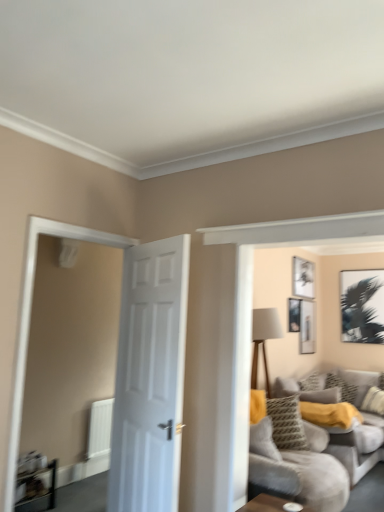
How much space does patterned fabric pillow at center-right, arranged as the third pillow when viewed from the right, occupy vertically?

patterned fabric pillow at center-right, arranged as the third pillow when viewed from the right, is 11.80 inches tall.

The width and height of the screenshot is (384, 512). What do you see at coordinates (37, 490) in the screenshot?
I see `wooden table at lower left` at bounding box center [37, 490].

What do you see at coordinates (342, 387) in the screenshot? I see `yellow textured pillow at center, the second pillow from the left` at bounding box center [342, 387].

The width and height of the screenshot is (384, 512). What do you see at coordinates (373, 401) in the screenshot?
I see `patterned fabric pillow at right, which is the third pillow in left-to-right order` at bounding box center [373, 401].

Find the location of a particular element. This screenshot has height=512, width=384. clear glass door at left is located at coordinates (29, 322).

Locate an element on the screen. The width and height of the screenshot is (384, 512). patterned fabric pillow at center-right, which appears as the first pillow when viewed from the left is located at coordinates (313, 382).

Is clear glass door at left to the left or to the right of white matte picture frame at upper center, which is the 2th picture frame from left to right, in the image?

Based on their positions, clear glass door at left is located to the left of white matte picture frame at upper center, which is the 2th picture frame from left to right.

Which of these two, clear glass door at left or white matte picture frame at upper center, which is the 2th picture frame from left to right, is smaller?

With smaller size is white matte picture frame at upper center, which is the 2th picture frame from left to right.

Is clear glass door at left facing towards white matte picture frame at upper center, which is the 2th picture frame from left to right?

No, clear glass door at left is not turned towards white matte picture frame at upper center, which is the 2th picture frame from left to right.

From the image's perspective, would you say clear glass door at left is positioned over white matte picture frame at upper center, the 3th picture frame positioned from the right?

Actually, clear glass door at left appears below white matte picture frame at upper center, the 3th picture frame positioned from the right, in the image.

Consider the image. Are yellow textured pillow at center, which ranks as the second pillow in right-to-left order, and matte black picture frame at upper center, which is the fourth picture frame from right to left, making contact?

They are not placed beside each other.

Is yellow textured pillow at center, the second pillow from the left, oriented away from matte black picture frame at upper center, marked as the first picture frame in a left-to-right arrangement?

That's not correct — yellow textured pillow at center, the second pillow from the left, is not looking away from matte black picture frame at upper center, marked as the first picture frame in a left-to-right arrangement.

From a real-world perspective, is yellow textured pillow at center, which ranks as the second pillow in right-to-left order, over matte black picture frame at upper center, marked as the first picture frame in a left-to-right arrangement?

No, from a real-world perspective, yellow textured pillow at center, which ranks as the second pillow in right-to-left order, is not above matte black picture frame at upper center, marked as the first picture frame in a left-to-right arrangement.

Looking at the image, does yellow textured pillow at center, which ranks as the second pillow in right-to-left order, seem bigger or smaller compared to matte black picture frame at upper center, which is the fourth picture frame from right to left?

Clearly, yellow textured pillow at center, which ranks as the second pillow in right-to-left order, is larger in size than matte black picture frame at upper center, which is the fourth picture frame from right to left.

Is point (300, 286) closer or farther from the camera than point (317, 390)?

Point (300, 286) appears to be farther away from the viewer than point (317, 390).

From the image's perspective, which picture frame is the 4th one above the patterned fabric pillow at center-right, which appears as the first pillow when viewed from the left? Please provide its 2D coordinates.

[(303, 278)]

Are white matte picture frame at upper center, the 3th picture frame positioned from the right, and patterned fabric pillow at center-right, which appears as the first pillow when viewed from the left, located far from each other?

Yes.

Between point (296, 300) and point (367, 404), which one is positioned behind?

The point (296, 300) is farther from the camera.

Where is `the 3rd pillow below the matte black picture frame at upper center, which is the fourth picture frame from right to left (from the image's perspective)`? The width and height of the screenshot is (384, 512). the 3rd pillow below the matte black picture frame at upper center, which is the fourth picture frame from right to left (from the image's perspective) is located at coordinates (373, 401).

From the image's perspective, would you say matte black picture frame at upper center, marked as the first picture frame in a left-to-right arrangement, is shown under patterned fabric pillow at right, which is the third pillow in left-to-right order?

Actually, matte black picture frame at upper center, marked as the first picture frame in a left-to-right arrangement, appears above patterned fabric pillow at right, which is the third pillow in left-to-right order, in the image.

Is matte black picture frame at upper center, marked as the first picture frame in a left-to-right arrangement, taller or shorter than patterned fabric pillow at right, which is the third pillow in left-to-right order?

In the image, matte black picture frame at upper center, marked as the first picture frame in a left-to-right arrangement, appears to be shorter than patterned fabric pillow at right, which is the third pillow in left-to-right order.

Does clear glass door at left have a larger size compared to matte black picture frame at upper right, marked as the second picture frame in a right-to-left arrangement?

Indeed, clear glass door at left has a larger size compared to matte black picture frame at upper right, marked as the second picture frame in a right-to-left arrangement.

Considering the relative sizes of clear glass door at left and matte black picture frame at upper right, marked as the second picture frame in a right-to-left arrangement, in the image provided, is clear glass door at left wider than matte black picture frame at upper right, marked as the second picture frame in a right-to-left arrangement,?

Correct, the width of clear glass door at left exceeds that of matte black picture frame at upper right, marked as the second picture frame in a right-to-left arrangement.

Is point (84, 228) in front of point (315, 344)?

Yes, point (84, 228) is in front of point (315, 344).

Between clear glass door at left and wooden table at lower left, which one is positioned behind?

wooden table at lower left is further from the camera.

Does clear glass door at left have a greater height compared to wooden table at lower left?

Indeed, clear glass door at left has a greater height compared to wooden table at lower left.

The image size is (384, 512). I want to click on glass door lying in front of the wooden table at lower left, so click(29, 322).

In the scene shown: Can we say clear glass door at left lies outside wooden table at lower left?

Indeed, clear glass door at left is completely outside wooden table at lower left.

Is patterned fabric pillow at center-right, arranged as the third pillow when viewed from the right, facing away from yellow textured pillow at center, which ranks as the second pillow in right-to-left order?

That's not correct — patterned fabric pillow at center-right, arranged as the third pillow when viewed from the right, is not looking away from yellow textured pillow at center, which ranks as the second pillow in right-to-left order.

Who is shorter, patterned fabric pillow at center-right, arranged as the third pillow when viewed from the right, or yellow textured pillow at center, the second pillow from the left?

patterned fabric pillow at center-right, arranged as the third pillow when viewed from the right, is shorter.

Which is nearer, (325, 374) or (329, 385)?

Point (329, 385)

Is patterned fabric pillow at center-right, which appears as the first pillow when viewed from the left, not near yellow textured pillow at center, the second pillow from the left?

They are positioned close to each other.

In the image, there is a white matte picture frame at upper center, the 3th picture frame positioned from the right. What are the coordinates of `glass door below it (from the image's perspective)` in the screenshot? It's located at (29, 322).

Identify the location of the 2nd pillow located beneath the matte black picture frame at upper center, which is the fourth picture frame from right to left (from a real-world perspective). (342, 387).

Consider the image. Based on their spatial positions, is patterned fabric pillow at right, which is counted as the 1th pillow, starting from the right, or white matte picture frame at upper center, which is the 2th picture frame from left to right, further from matte black picture frame at upper center, marked as the first picture frame in a left-to-right arrangement?

Based on the image, patterned fabric pillow at right, which is counted as the 1th pillow, starting from the right, appears to be further to matte black picture frame at upper center, marked as the first picture frame in a left-to-right arrangement.

Looking at this image, looking at the image, which one is located closer to patterned fabric pillow at center-right, arranged as the third pillow when viewed from the right, matte black picture frame at upper center, marked as the first picture frame in a left-to-right arrangement, or wooden table at lower left?

Among the two, matte black picture frame at upper center, marked as the first picture frame in a left-to-right arrangement, is located nearer to patterned fabric pillow at center-right, arranged as the third pillow when viewed from the right.

From the image, which object appears to be farther from soft gray fabric couch at right, white matte picture frame at upper center, which is the 2th picture frame from left to right, or patterned fabric pillow at center-right, which appears as the first pillow when viewed from the left?

The object further to soft gray fabric couch at right is white matte picture frame at upper center, which is the 2th picture frame from left to right.

When comparing their distances from matte black picture frame at upper right, which is the 3th picture frame in left-to-right order, does yellow textured pillow at center, the second pillow from the left, or white matte picture frame at upper center, which is the 2th picture frame from left to right, seem closer?

white matte picture frame at upper center, which is the 2th picture frame from left to right, lies closer to matte black picture frame at upper right, which is the 3th picture frame in left-to-right order, than the other object.

Considering their positions, is patterned fabric pillow at right, which is the third pillow in left-to-right order, positioned closer to black matte picture frame at upper right, the fourth picture frame in the left-to-right sequence, than yellow textured pillow at center, the second pillow from the left?

Based on the image, yellow textured pillow at center, the second pillow from the left, appears to be nearer to black matte picture frame at upper right, the fourth picture frame in the left-to-right sequence.

Based on the photo, from the image, which object appears to be nearer to patterned fabric pillow at center-right, arranged as the third pillow when viewed from the right, white matte picture frame at upper center, the 3th picture frame positioned from the right, or white glossy door at center?

Among the two, white matte picture frame at upper center, the 3th picture frame positioned from the right, is located nearer to patterned fabric pillow at center-right, arranged as the third pillow when viewed from the right.

Estimate the real-world distances between objects in this image. Which object is closer to black matte picture frame at upper right, the fourth picture frame in the left-to-right sequence, matte black picture frame at upper right, which is the 3th picture frame in left-to-right order, or matte black picture frame at upper center, which is the fourth picture frame from right to left?

matte black picture frame at upper right, which is the 3th picture frame in left-to-right order.

Estimate the real-world distances between objects in this image. Which object is further from wooden table at lower left, patterned fabric pillow at center-right, arranged as the third pillow when viewed from the right, or white glossy door at center?

patterned fabric pillow at center-right, arranged as the third pillow when viewed from the right, is further to wooden table at lower left.

I want to click on table between clear glass door at left and white matte picture frame at upper center, which is the 2th picture frame from left to right, along the z-axis, so click(x=37, y=490).

Identify the location of table between clear glass door at left and matte black picture frame at upper right, which is the 3th picture frame in left-to-right order, along the z-axis. This screenshot has height=512, width=384. (37, 490).

You are a GUI agent. You are given a task and a screenshot of the screen. Output one action in this format:
    pyautogui.click(x=<x>, y=<y>)
    Task: Click on the studio couch located between white glossy door at center and white matte picture frame at upper center, the 3th picture frame positioned from the right, in the depth direction
    This screenshot has height=512, width=384.
    Given the screenshot: What is the action you would take?
    pyautogui.click(x=310, y=467)

The width and height of the screenshot is (384, 512). In order to click on glass door between white glossy door at center and patterned fabric pillow at center-right, arranged as the third pillow when viewed from the right, from front to back in this screenshot , I will do `click(29, 322)`.